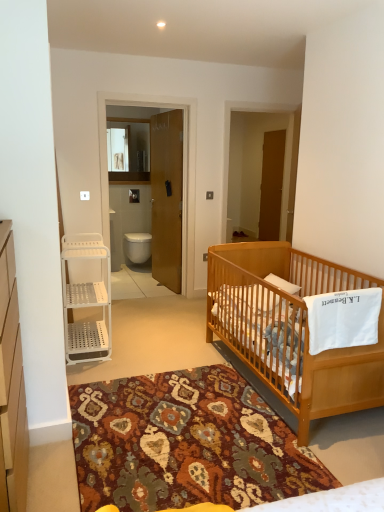
Question: From a real-world perspective, is light brown wooden crib at lower right over white plastic shelving unit at left?

Choices:
 (A) no
 (B) yes

Answer: (A)

Question: Can you confirm if light brown wooden crib at lower right is shorter than white plastic shelving unit at left?

Choices:
 (A) yes
 (B) no

Answer: (A)

Question: Can you confirm if light brown wooden crib at lower right is positioned to the left of white plastic shelving unit at left?

Choices:
 (A) no
 (B) yes

Answer: (A)

Question: Does light brown wooden crib at lower right lie in front of white plastic shelving unit at left?

Choices:
 (A) no
 (B) yes

Answer: (A)

Question: Could white plastic shelving unit at left be considered to be inside light brown wooden crib at lower right?

Choices:
 (A) no
 (B) yes

Answer: (A)

Question: Considering the positions of white glossy toilet at center and brown wooden door at center in the image, is white glossy toilet at center taller or shorter than brown wooden door at center?

Choices:
 (A) short
 (B) tall

Answer: (A)

Question: Is point (134, 251) positioned closer to the camera than point (150, 195)?

Choices:
 (A) farther
 (B) closer

Answer: (A)

Question: Relative to brown wooden door at center, is white glossy toilet at center in front or behind?

Choices:
 (A) behind
 (B) front

Answer: (A)

Question: Is white glossy toilet at center inside or outside of brown wooden door at center?

Choices:
 (A) outside
 (B) inside

Answer: (A)

Question: Based on their positions, is brown wooden screen door at center located to the left or right of patterned carpet at center?

Choices:
 (A) right
 (B) left

Answer: (A)

Question: Considering the positions of point [x=259, y=216] and point [x=253, y=498], is point [x=259, y=216] closer or farther from the camera than point [x=253, y=498]?

Choices:
 (A) farther
 (B) closer

Answer: (A)

Question: Relative to patterned carpet at center, is brown wooden screen door at center in front or behind?

Choices:
 (A) behind
 (B) front

Answer: (A)

Question: From a real-world perspective, is brown wooden screen door at center physically located above or below patterned carpet at center?

Choices:
 (A) above
 (B) below

Answer: (A)

Question: Which is correct: white plastic shelving unit at left is inside patterned carpet at center, or outside of it?

Choices:
 (A) outside
 (B) inside

Answer: (A)

Question: From a real-world perspective, is white plastic shelving unit at left positioned above or below patterned carpet at center?

Choices:
 (A) below
 (B) above

Answer: (B)